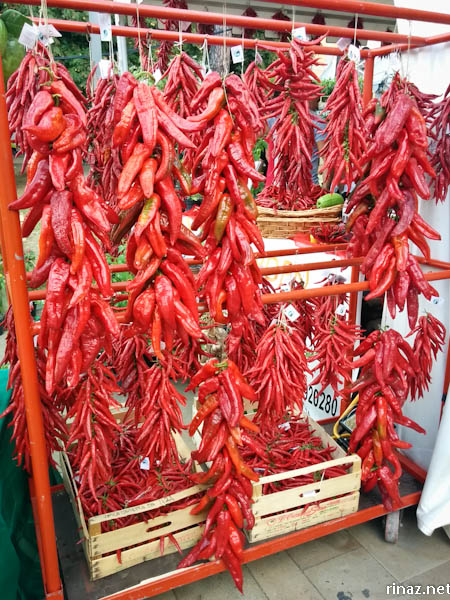
Find the location of `floor`. floor is located at coordinates (320, 581).